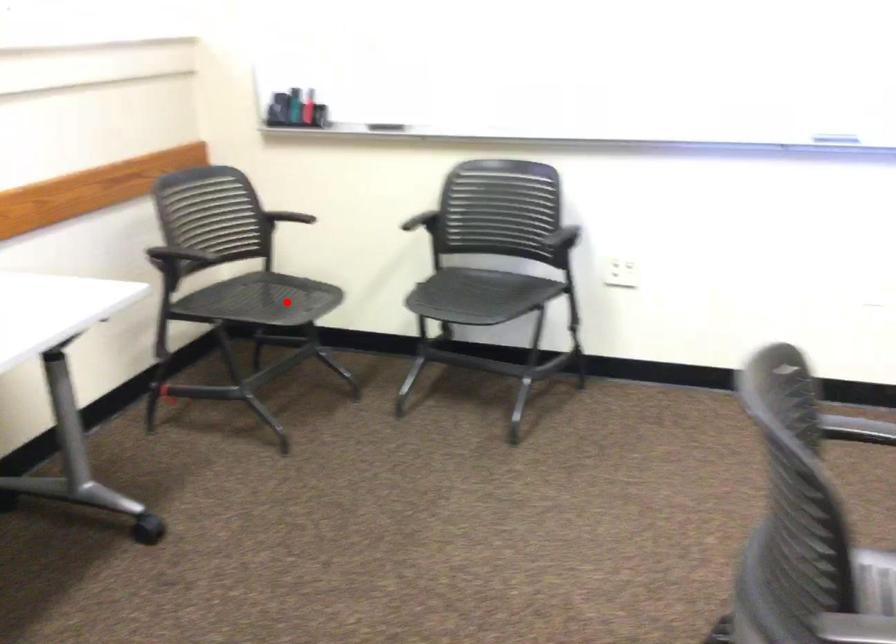
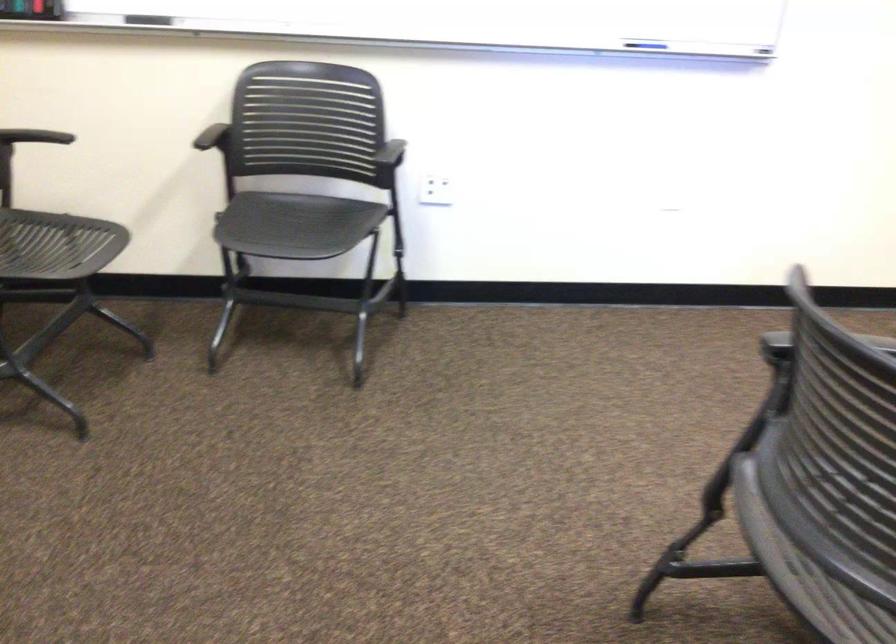
Question: I am providing you with two images of the same scene from different viewpoints. Image1 has a red point marked. In image2, the corresponding 3D location appears at what relative position? Reply with the corresponding letter.

Choices:
 (A) Closer
 (B) Farther

Answer: (A)